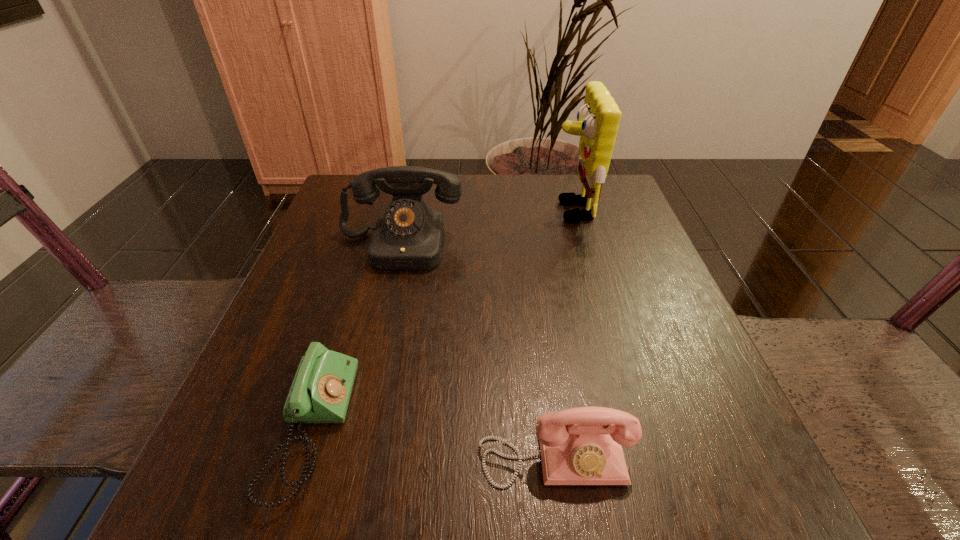
I want to click on free space between the second tallest telephone and the sponge, so click(563, 333).

The height and width of the screenshot is (540, 960). Identify the location of free space between the second tallest object and the shortest object. (356, 336).

Where is `blank region between the rightmost telephone and the second tallest object`? The width and height of the screenshot is (960, 540). blank region between the rightmost telephone and the second tallest object is located at coordinates (477, 350).

What are the coordinates of `unoccupied position between the shortest object and the tallest telephone` in the screenshot? It's located at (356, 336).

Find the location of a particular element. This screenshot has width=960, height=540. empty space between the tallest object and the shortest telephone is located at coordinates (442, 320).

Locate an element on the screen. This screenshot has width=960, height=540. empty location between the shortest object and the tallest object is located at coordinates (442, 320).

Locate an element on the screen. This screenshot has width=960, height=540. object that is the closest one to the shortest object is located at coordinates coord(579,446).

This screenshot has width=960, height=540. I want to click on object that is the nearest to the shortest object, so click(x=579, y=446).

The image size is (960, 540). What are the coordinates of `the closest telephone relative to the shortest object` in the screenshot? It's located at (579, 446).

Choose which telephone is the nearest neighbor to the third tallest object. Please provide its 2D coordinates. Your answer should be formatted as a tuple, i.e. [(x, y)], where the tuple contains the x and y coordinates of a point satisfying the conditions above.

[(320, 393)]